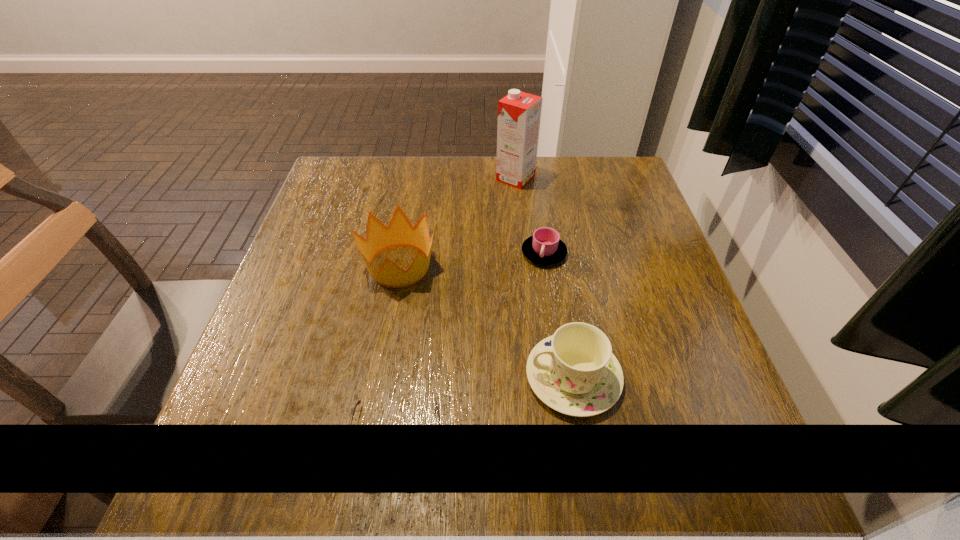
Identify the location of vacant point located on the handle side of the chinaware. (324, 377).

Where is `vacant space positioned 0.220m on the side with the handle of the cup`? Image resolution: width=960 pixels, height=540 pixels. vacant space positioned 0.220m on the side with the handle of the cup is located at coordinates coord(559,353).

The image size is (960, 540). I want to click on object located at the far edge, so click(x=519, y=113).

Find the location of a particular element. The height and width of the screenshot is (540, 960). object that is positioned at the near edge is located at coordinates (359, 401).

You are a GUI agent. You are given a task and a screenshot of the screen. Output one action in this format:
    pyautogui.click(x=<x>, y=<y>)
    Task: Click on the object that is positioned at the left edge
    This screenshot has height=540, width=960.
    Given the screenshot: What is the action you would take?
    pyautogui.click(x=400, y=232)

In the image, there is a desktop. Where is `vacant space at the far edge`? This screenshot has width=960, height=540. vacant space at the far edge is located at coordinates (465, 159).

Image resolution: width=960 pixels, height=540 pixels. I want to click on vacant space at the left edge of the desktop, so click(313, 246).

Locate an element on the screen. free location at the right edge of the desktop is located at coordinates (639, 234).

Find the location of a particular element. free location at the far left corner is located at coordinates (349, 178).

Identify the location of free region at the near left corner of the desktop. (271, 509).